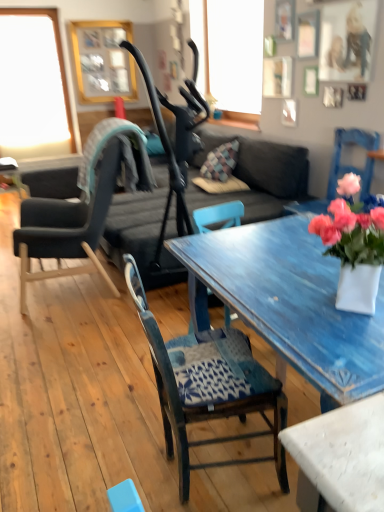
What do you see at coordinates (208, 386) in the screenshot?
I see `wooden chair with patterned cushion at center, positioned as the first chair in right-to-left order` at bounding box center [208, 386].

Describe the element at coordinates (82, 205) in the screenshot. Image resolution: width=384 pixels, height=512 pixels. I see `teal fabric chair at center, which is counted as the first chair, starting from the left` at that location.

The height and width of the screenshot is (512, 384). What are the coordinates of `pink matte vase at right` in the screenshot? It's located at (349, 216).

What is the approximate width of transparent glass window at upper left?

transparent glass window at upper left is 6.86 centimeters in width.

Identify the location of wooden chair with patterned cushion at center, which is the 1th chair from front to back. (208, 386).

Would you say teal fabric chair at center, positioned as the first chair in back-to-front order, contains dark gray fabric couch at center?

No.

In the scene shown: Is teal fabric chair at center, which is counted as the 2th chair, starting from the front, taller or shorter than dark gray fabric couch at center?

Clearly, teal fabric chair at center, which is counted as the 2th chair, starting from the front, is taller compared to dark gray fabric couch at center.

Are teal fabric chair at center, which is counted as the first chair, starting from the left, and dark gray fabric couch at center located far from each other?

teal fabric chair at center, which is counted as the first chair, starting from the left, is actually quite close to dark gray fabric couch at center.

Can you confirm if teal fabric chair at center, positioned as the first chair in back-to-front order, is positioned to the left of dark gray fabric couch at center?

Yes.

Is pink matte vase at right positioned far away from teal fabric chair at center, positioned as the first chair in back-to-front order?

Yes, pink matte vase at right is far from teal fabric chair at center, positioned as the first chair in back-to-front order.

Considering the sizes of objects pink matte vase at right and teal fabric chair at center, positioned as the first chair in back-to-front order, in the image provided, who is shorter, pink matte vase at right or teal fabric chair at center, positioned as the first chair in back-to-front order,?

pink matte vase at right.

Which is behind, point (329, 233) or point (45, 239)?

The point (45, 239) is more distant.

Which object is thinner, pink matte vase at right or teal fabric chair at center, which is the 2th chair in right-to-left order?

pink matte vase at right is thinner.

Is point (135, 294) positioned behind point (358, 184)?

That is False.

From a real-world perspective, is wooden chair with patterned cushion at center, the 2th chair positioned from the left, physically above pink matte vase at right?

Incorrect, from a real-world perspective, wooden chair with patterned cushion at center, the 2th chair positioned from the left, is lower than pink matte vase at right.

Is wooden chair with patterned cushion at center, the second chair when ordered from back to front, situated inside pink matte vase at right or outside?

wooden chair with patterned cushion at center, the second chair when ordered from back to front, exists outside the volume of pink matte vase at right.

Is there a large distance between wooden chair with patterned cushion at center, the 2th chair positioned from the left, and gold wooden picture frame at upper center?

Yes.

Is wooden chair with patterned cushion at center, the 2th chair positioned from the left, bigger or smaller than gold wooden picture frame at upper center?

In the image, wooden chair with patterned cushion at center, the 2th chair positioned from the left, appears to be larger than gold wooden picture frame at upper center.

Is wooden chair with patterned cushion at center, which is the 1th chair from front to back, oriented away from gold wooden picture frame at upper center?

No, wooden chair with patterned cushion at center, which is the 1th chair from front to back,'s orientation is not away from gold wooden picture frame at upper center.

Is pink matte vase at right inside or outside of gold wooden picture frame at upper center?

pink matte vase at right exists outside the volume of gold wooden picture frame at upper center.

Is pink matte vase at right oriented towards gold wooden picture frame at upper center?

No, pink matte vase at right is not aimed at gold wooden picture frame at upper center.

From a real-world perspective, who is located lower, pink matte vase at right or gold wooden picture frame at upper center?

From a 3D spatial view, pink matte vase at right is below.

Is point (326, 214) positioned in front of point (91, 48)?

Yes, it is.

Is transparent glass window at upper left positioned with its back to teal fabric chair at center, which is counted as the 2th chair, starting from the front?

No, transparent glass window at upper left is not facing away from teal fabric chair at center, which is counted as the 2th chair, starting from the front.

From the image's perspective, relative to teal fabric chair at center, positioned as the first chair in back-to-front order, is transparent glass window at upper left above or below?

From the image's perspective, transparent glass window at upper left appears above teal fabric chair at center, positioned as the first chair in back-to-front order.

Does point (43, 39) come farther from viewer compared to point (105, 139)?

Yes, point (43, 39) is farther from viewer.

Is teal fabric chair at center, which is the 2th chair in right-to-left order, located within transparent glass window at upper left?

Actually, teal fabric chair at center, which is the 2th chair in right-to-left order, is outside transparent glass window at upper left.

Does point (86, 82) come farther from viewer compared to point (65, 232)?

That is True.

Is gold wooden picture frame at upper center oriented towards teal fabric chair at center, which is counted as the 2th chair, starting from the front?

Yes, gold wooden picture frame at upper center is oriented towards teal fabric chair at center, which is counted as the 2th chair, starting from the front.

From the image's perspective, is gold wooden picture frame at upper center located beneath teal fabric chair at center, positioned as the first chair in back-to-front order?

Incorrect, from the image's perspective, gold wooden picture frame at upper center is higher than teal fabric chair at center, positioned as the first chair in back-to-front order.

Between gold wooden picture frame at upper center and teal fabric chair at center, which is the 2th chair in right-to-left order, which one has larger size?

With larger size is teal fabric chair at center, which is the 2th chair in right-to-left order.

Locate an element on the screen. The image size is (384, 512). chair that is the 2nd object to the left of the dark gray fabric couch at center, starting at the anchor is located at coordinates (82, 205).

You are a GUI agent. You are given a task and a screenshot of the screen. Output one action in this format:
    pyautogui.click(x=<x>, y=<y>)
    Task: Click on the flower on the right of teal fabric chair at center, positioned as the first chair in back-to-front order
    
    Given the screenshot: What is the action you would take?
    pyautogui.click(x=349, y=216)

Which object lies nearer to the anchor point pink matte vase at right, teal fabric chair at center, which is counted as the first chair, starting from the left, or transparent glass window at upper left?

teal fabric chair at center, which is counted as the first chair, starting from the left, is positioned closer to the anchor pink matte vase at right.

Considering their positions, is gold wooden picture frame at upper center positioned closer to dark gray fabric couch at center than wooden chair with patterned cushion at center, the second chair when ordered from back to front?

wooden chair with patterned cushion at center, the second chair when ordered from back to front, is closer to dark gray fabric couch at center.

Considering their positions, is wooden chair with patterned cushion at center, which is the 1th chair from front to back, positioned closer to transparent glass window at upper left than gold wooden picture frame at upper center?

gold wooden picture frame at upper center lies closer to transparent glass window at upper left than the other object.

Estimate the real-world distances between objects in this image. Which object is further from wooden chair with patterned cushion at center, the second chair when ordered from back to front, dark gray fabric couch at center or pink matte vase at right?

dark gray fabric couch at center is further to wooden chair with patterned cushion at center, the second chair when ordered from back to front.

In the scene shown: Which object lies nearer to the anchor point gold wooden picture frame at upper center, wooden chair with patterned cushion at center, which is the 1th chair from front to back, or pink matte vase at right?

wooden chair with patterned cushion at center, which is the 1th chair from front to back, lies closer to gold wooden picture frame at upper center than the other object.

From the image, which object appears to be farther from transparent glass window at upper left, pink matte vase at right or wooden chair with patterned cushion at center, positioned as the first chair in right-to-left order?

pink matte vase at right lies further to transparent glass window at upper left than the other object.

Estimate the real-world distances between objects in this image. Which object is further from gold wooden picture frame at upper center, transparent glass window at upper left or teal fabric chair at center, which is the 2th chair in right-to-left order?

teal fabric chair at center, which is the 2th chair in right-to-left order, is further to gold wooden picture frame at upper center.

From the image, which object appears to be farther from dark gray fabric couch at center, teal fabric chair at center, which is counted as the 2th chair, starting from the front, or pink matte vase at right?

pink matte vase at right is positioned further to the anchor dark gray fabric couch at center.

Identify the location of chair located between wooden chair with patterned cushion at center, positioned as the first chair in right-to-left order, and gold wooden picture frame at upper center in the depth direction. (82, 205).

Identify the location of studio couch between teal fabric chair at center, which is the 2th chair in right-to-left order, and transparent glass window at upper left in the front-back direction. The width and height of the screenshot is (384, 512). (261, 180).

At what (x,y) coordinates should I click in order to perform the action: click on flower positioned between wooden chair with patterned cushion at center, which is the 1th chair from front to back, and transparent glass window at upper left from near to far. Please return your answer as a coordinate pair (x, y). Looking at the image, I should click on (349, 216).

I want to click on studio couch between wooden chair with patterned cushion at center, which is the 1th chair from front to back, and gold wooden picture frame at upper center from front to back, so click(x=261, y=180).